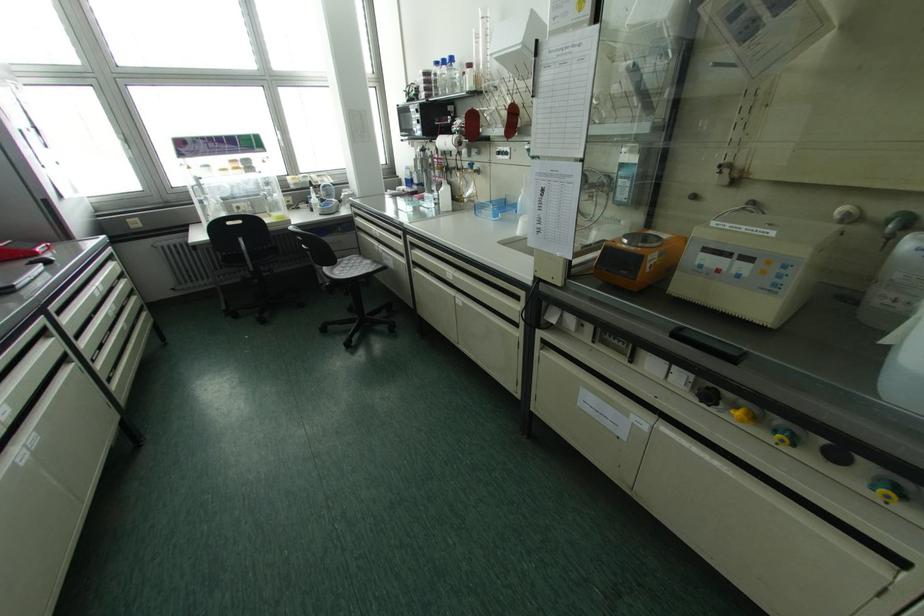
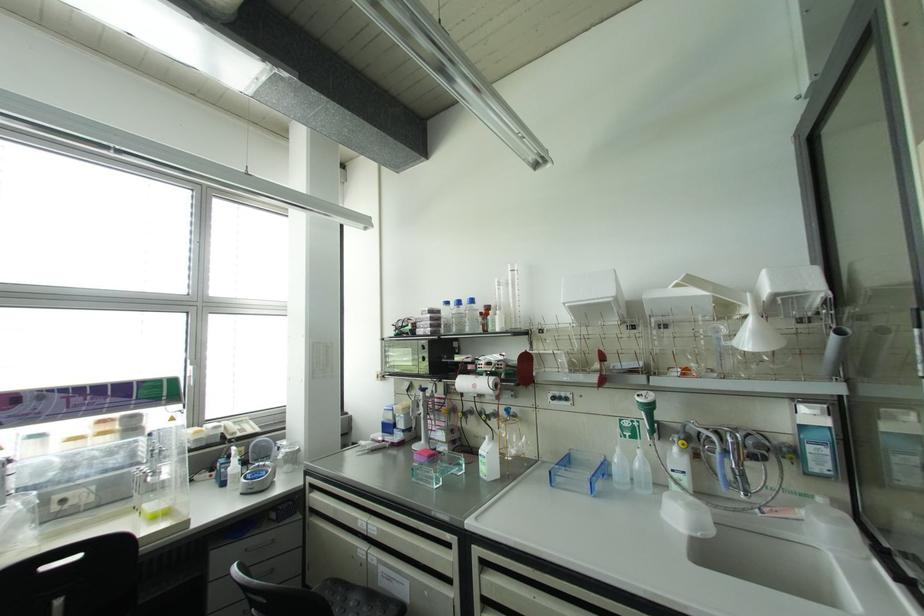
Locate, in the second image, the point that corresponds to pixel 408 182 in the first image.

(387, 427)